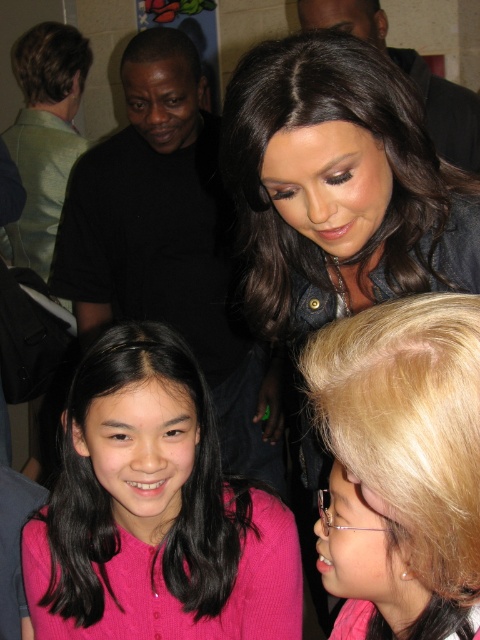
Does shiny black hair at center appear on the left side of blonde hair at upper right?

Incorrect, shiny black hair at center is not on the left side of blonde hair at upper right.

Does shiny black hair at center have a lesser height compared to blonde hair at upper right?

No, shiny black hair at center is not shorter than blonde hair at upper right.

Between point (312, 200) and point (454, 474), which one is positioned in front?

Point (454, 474)

Where is `shiny black hair at center`? The width and height of the screenshot is (480, 640). shiny black hair at center is located at coordinates (338, 186).

Between pink knitted sweater at center and blonde hair at upper right, which one appears on the left side from the viewer's perspective?

Positioned to the left is pink knitted sweater at center.

Between pink knitted sweater at center and blonde hair at upper right, which one has less height?

blonde hair at upper right is shorter.

Find the location of a particular element. The height and width of the screenshot is (640, 480). pink knitted sweater at center is located at coordinates (165, 522).

Who is lower down, shiny black hair at center or pink knitted sweater at center?

Positioned lower is pink knitted sweater at center.

Is shiny black hair at center closer to camera compared to pink knitted sweater at center?

Yes, it is in front of pink knitted sweater at center.

This screenshot has height=640, width=480. What do you see at coordinates (338, 186) in the screenshot?
I see `shiny black hair at center` at bounding box center [338, 186].

Identify the location of shiny black hair at center. This screenshot has height=640, width=480. (338, 186).